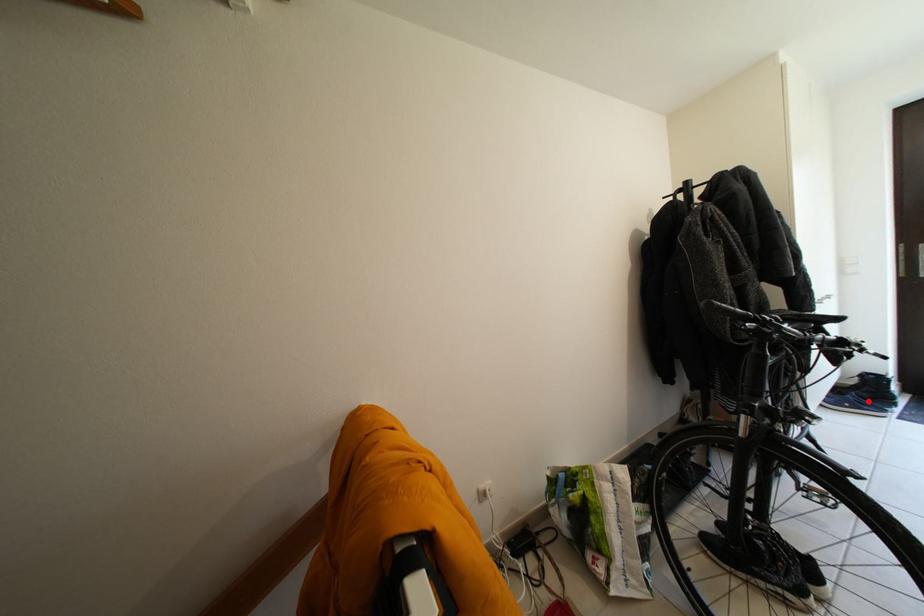
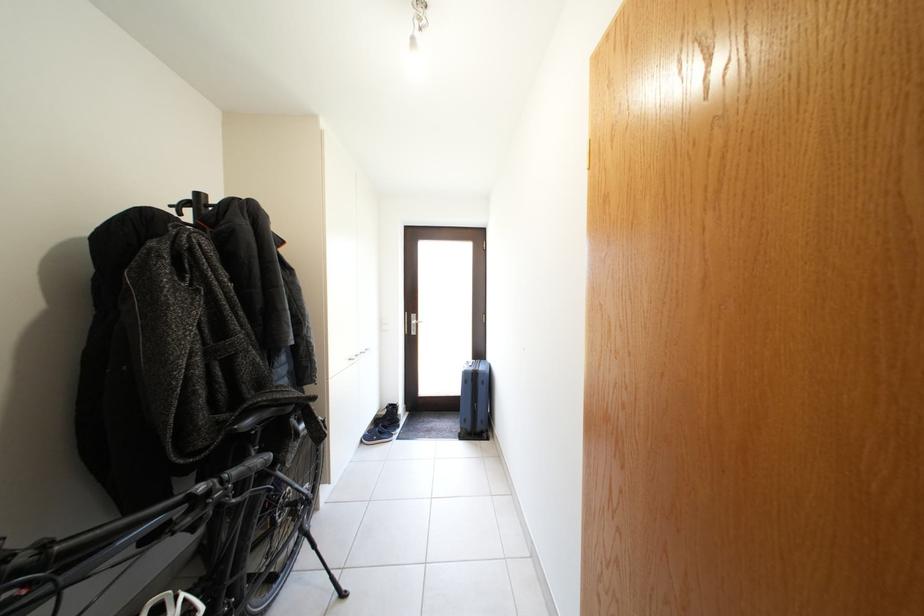
Question: I am providing you with two images of the same scene from different viewpoints. Image1 has a red point marked. In image2, the corresponding 3D location appears at what relative position? Reply with the corresponding letter.

Choices:
 (A) Closer
 (B) Farther

Answer: (B)